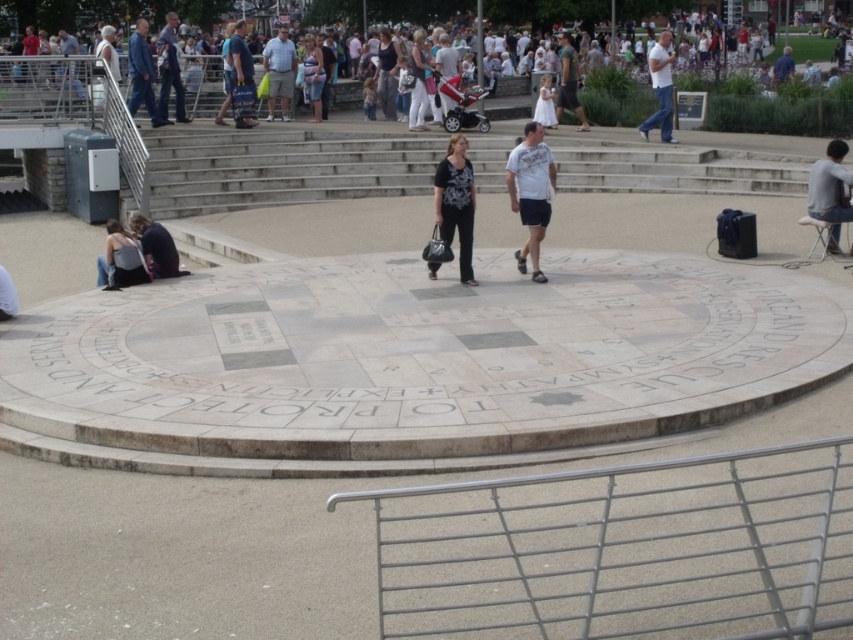
You are standing at the center of the plaza and see a point located at coordinates (x=103, y=12). According to the image, where exactly is this point located?

The point at coordinates (x=103, y=12) is located on the white cotton dress at upper center.

You are a photographer trying to capture a shot of the white cotton dress at upper center and the dark blue jeans at upper left. From your current position, which of the two items is positioned higher in the frame?

The white cotton dress at upper center is located above dark blue jeans at upper left, so it is positioned higher in the frame.